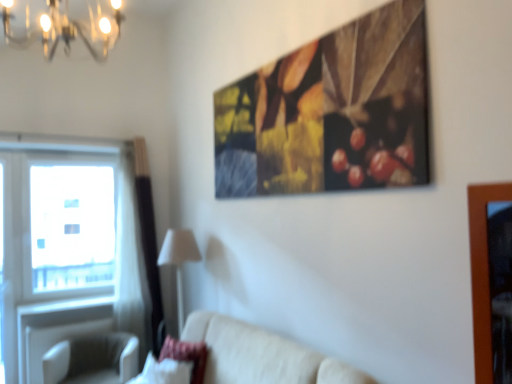
Question: Is beige fabric couch at lower center inside or outside of metallic chandelier at upper left?

Choices:
 (A) inside
 (B) outside

Answer: (B)

Question: Considering the positions of beige fabric couch at lower center and metallic chandelier at upper left in the image, is beige fabric couch at lower center taller or shorter than metallic chandelier at upper left?

Choices:
 (A) short
 (B) tall

Answer: (B)

Question: Estimate the real-world distances between objects in this image. Which object is closer to the transparent glass window at left?

Choices:
 (A) velvet pink pillow at lower left
 (B) beige fabric swivel chair at lower left
 (C) beige fabric couch at lower center
 (D) transparent glass window at left
 (E) white fabric lampshade at lower center

Answer: (D)

Question: Which is nearer to the beige fabric swivel chair at lower left?

Choices:
 (A) white fabric lampshade at lower center
 (B) velvet pink pillow at lower left
 (C) beige fabric couch at lower center
 (D) transparent glass window at left
 (E) metallic chandelier at upper left

Answer: (B)